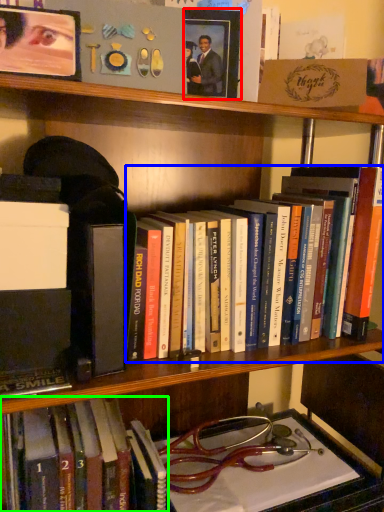
Question: Which object is the closest to the picture frame (highlighted by a red box)? Choose among these: book (highlighted by a blue box) or book (highlighted by a green box).

Choices:
 (A) book
 (B) book

Answer: (A)